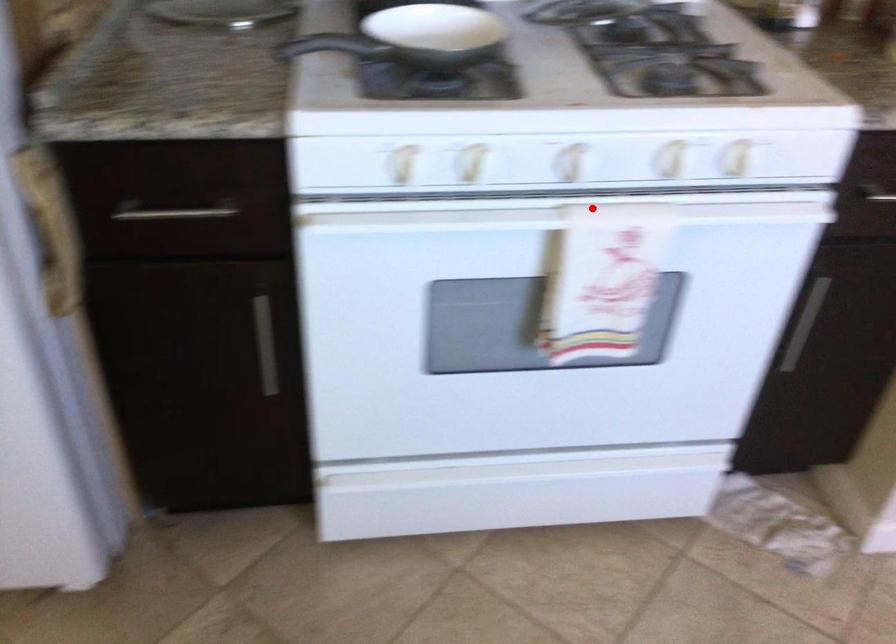
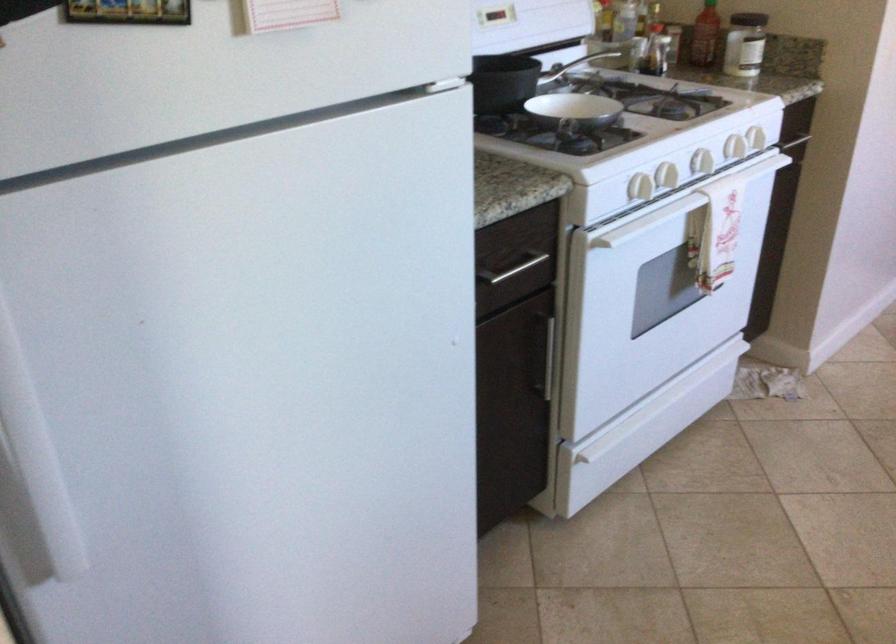
Question: I am providing you with two images of the same scene from different viewpoints. In image1, a red point is highlighted. Considering the same 3D point in image2, which of the following is correct?

Choices:
 (A) It is closer
 (B) It is farther

Answer: (B)